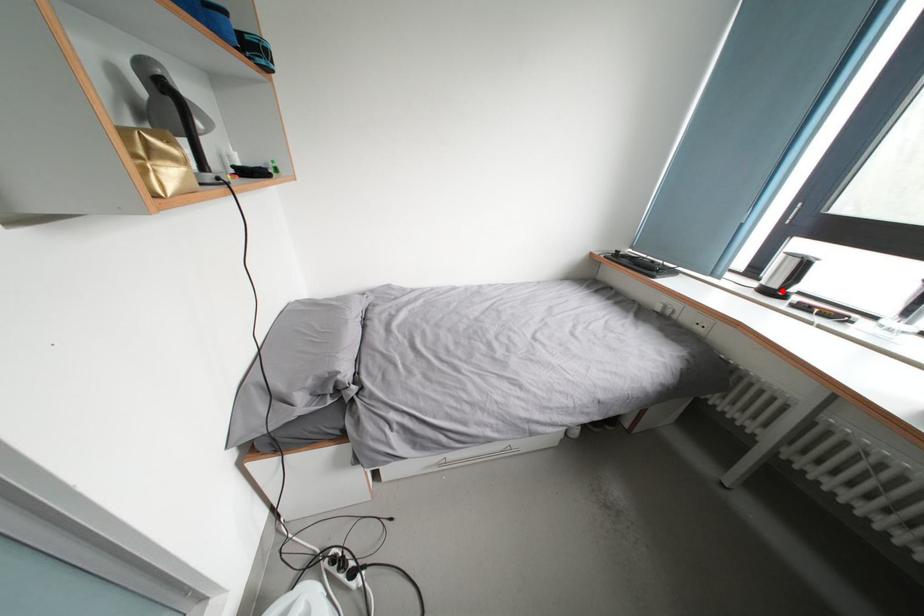
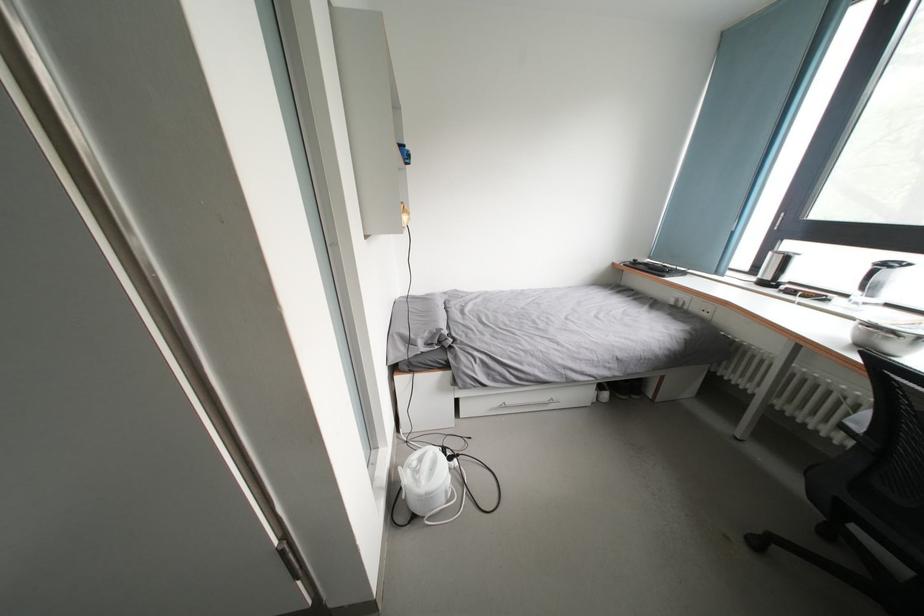
Where in the second image is the point corresponding to the highlighted location from the first image?

(774, 283)